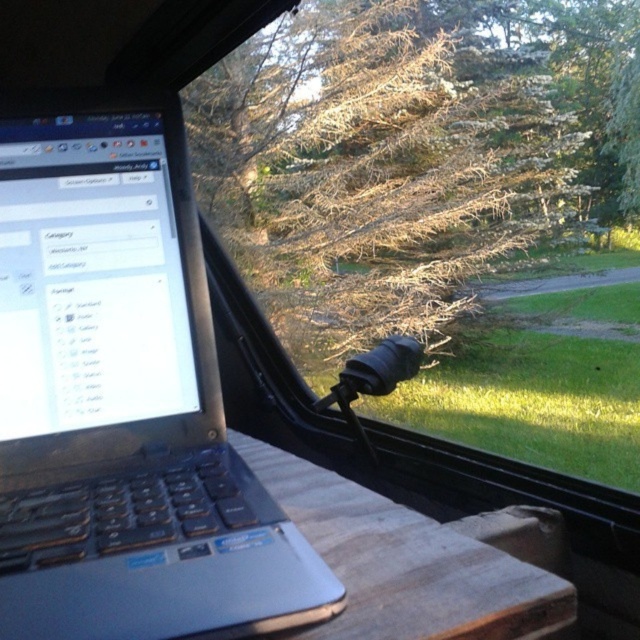
Measure the distance between slate gray plastic laptop at left and brown/dried wood tree at upper center.

slate gray plastic laptop at left is 7.54 feet away from brown/dried wood tree at upper center.

Can you confirm if slate gray plastic laptop at left is bigger than brown/dried wood tree at upper center?

No, slate gray plastic laptop at left is not bigger than brown/dried wood tree at upper center.

At what (x,y) coordinates should I click in order to perform the action: click on slate gray plastic laptop at left. Please return your answer as a coordinate pair (x, y). Looking at the image, I should click on (124, 397).

Identify the location of slate gray plastic laptop at left. (124, 397).